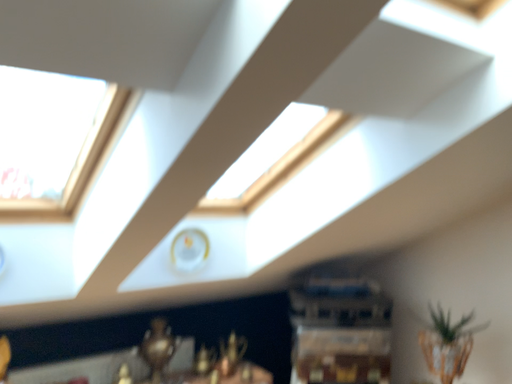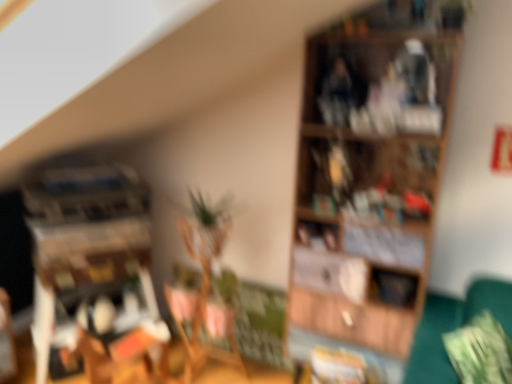
Question: Which way did the camera rotate in the video?

Choices:
 (A) rotated left
 (B) rotated right

Answer: (B)